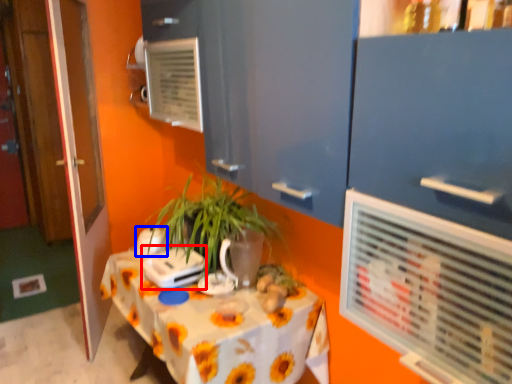
Question: Which object appears closest to the camera in this image, appliance (highlighted by a red box) or appliance (highlighted by a blue box)?

Choices:
 (A) appliance
 (B) appliance

Answer: (A)